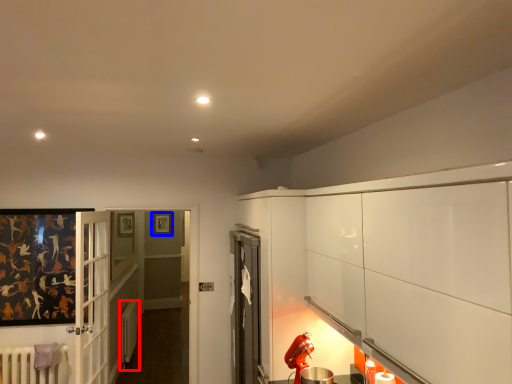
Question: Which object appears closest to the camera in this image, radiator (highlighted by a red box) or picture frame (highlighted by a blue box)?

Choices:
 (A) radiator
 (B) picture frame

Answer: (A)